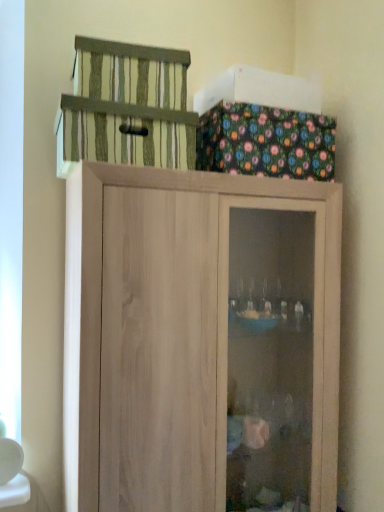
Question: From the image's perspective, is striped fabric cage at upper center positioned above or below natural wood cupboard at upper center?

Choices:
 (A) below
 (B) above

Answer: (B)

Question: In the image, is striped fabric cage at upper center positioned in front of or behind natural wood cupboard at upper center?

Choices:
 (A) behind
 (B) front

Answer: (A)

Question: From a real-world perspective, is striped fabric cage at upper center positioned above or below natural wood cupboard at upper center?

Choices:
 (A) below
 (B) above

Answer: (B)

Question: Is natural wood cupboard at upper center wider or thinner than striped fabric cage at upper center?

Choices:
 (A) wide
 (B) thin

Answer: (A)

Question: From the image's perspective, is natural wood cupboard at upper center above or below striped fabric cage at upper center?

Choices:
 (A) above
 (B) below

Answer: (B)

Question: Based on their sizes in the image, would you say natural wood cupboard at upper center is bigger or smaller than striped fabric cage at upper center?

Choices:
 (A) big
 (B) small

Answer: (A)

Question: Would you say natural wood cupboard at upper center is inside or outside striped fabric cage at upper center?

Choices:
 (A) outside
 (B) inside

Answer: (A)